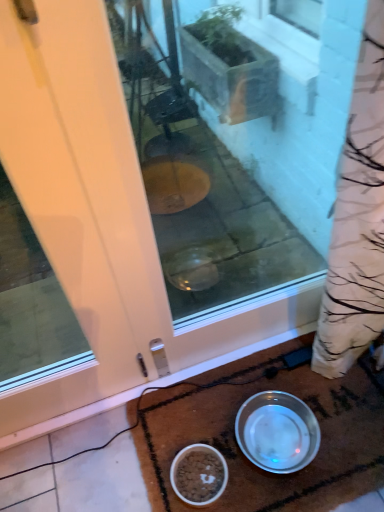
Where is `vacant area situated to the left side of silver metallic bowl at lower center, which ranks as the 2th bowl in left-to-right order`? vacant area situated to the left side of silver metallic bowl at lower center, which ranks as the 2th bowl in left-to-right order is located at coordinates (198, 429).